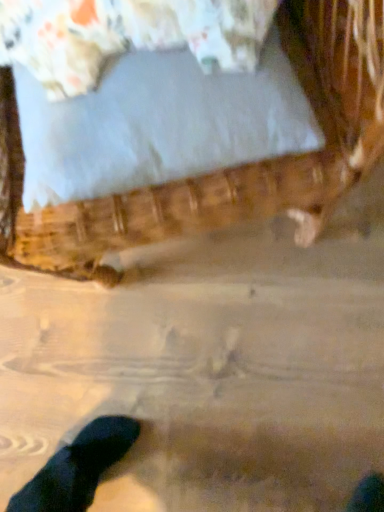
Measure the distance between white fabric pillow at upper center and camera.

white fabric pillow at upper center is 43.40 centimeters away from camera.

Find the location of a particular element. The height and width of the screenshot is (512, 384). white fabric pillow at upper center is located at coordinates (127, 35).

This screenshot has width=384, height=512. Describe the element at coordinates (127, 35) in the screenshot. I see `white fabric pillow at upper center` at that location.

Find the location of a particular element. The image size is (384, 512). wooden bed at upper center is located at coordinates (223, 169).

This screenshot has width=384, height=512. Describe the element at coordinates (223, 169) in the screenshot. I see `wooden bed at upper center` at that location.

In order to face wooden bed at upper center, should I rotate leftwards or rightwards?

It's best to rotate left around 8.963 degrees.

Find the location of a particular element. white fabric pillow at upper center is located at coordinates (127, 35).

Does white fabric pillow at upper center appear on the left side of wooden bed at upper center?

No, white fabric pillow at upper center is not to the left of wooden bed at upper center.

Which is behind, white fabric pillow at upper center or wooden bed at upper center?

Positioned behind is white fabric pillow at upper center.

Is point (187, 31) positioned in front of point (14, 234)?

Yes, it is.

From the image's perspective, which one is positioned lower, white fabric pillow at upper center or wooden bed at upper center?

From the image's view, white fabric pillow at upper center is below.

From a real-world perspective, is white fabric pillow at upper center physically above wooden bed at upper center?

Indeed, from a real-world perspective, white fabric pillow at upper center stands above wooden bed at upper center.

Between white fabric pillow at upper center and wooden bed at upper center, which one has smaller width?

Thinner between the two is white fabric pillow at upper center.

Is white fabric pillow at upper center taller or shorter than wooden bed at upper center?

In the image, white fabric pillow at upper center appears to be shorter than wooden bed at upper center.

Does white fabric pillow at upper center have a larger size compared to wooden bed at upper center?

Actually, white fabric pillow at upper center might be smaller than wooden bed at upper center.

Is white fabric pillow at upper center not inside wooden bed at upper center?

Actually, white fabric pillow at upper center is at least partially inside wooden bed at upper center.

Looking at this image, is white fabric pillow at upper center positioned far away from wooden bed at upper center?

white fabric pillow at upper center is near wooden bed at upper center, not far away.

Is white fabric pillow at upper center facing towards wooden bed at upper center?

Yes, white fabric pillow at upper center is facing wooden bed at upper center.

This screenshot has width=384, height=512. Find the location of `pillow above the wooden bed at upper center (from a real-world perspective)`. pillow above the wooden bed at upper center (from a real-world perspective) is located at coordinates (127, 35).

Considering the relative positions of wooden bed at upper center and white fabric pillow at upper center in the image provided, is wooden bed at upper center to the left of white fabric pillow at upper center from the viewer's perspective?

Yes, wooden bed at upper center is to the left of white fabric pillow at upper center.

Does wooden bed at upper center lie in front of white fabric pillow at upper center?

Yes.

Is point (207, 199) more distant than point (255, 24)?

Yes, point (207, 199) is behind point (255, 24).

From the image's perspective, does wooden bed at upper center appear lower than white fabric pillow at upper center?

No.

From a real-world perspective, is wooden bed at upper center physically located above or below white fabric pillow at upper center?

wooden bed at upper center is below white fabric pillow at upper center.

Can you confirm if wooden bed at upper center is thinner than white fabric pillow at upper center?

No.

In terms of height, does wooden bed at upper center look taller or shorter compared to white fabric pillow at upper center?

Considering their sizes, wooden bed at upper center has more height than white fabric pillow at upper center.

Considering the sizes of wooden bed at upper center and white fabric pillow at upper center in the image, is wooden bed at upper center bigger or smaller than white fabric pillow at upper center?

Considering their sizes, wooden bed at upper center takes up more space than white fabric pillow at upper center.

Is white fabric pillow at upper center located within wooden bed at upper center?

That's correct, white fabric pillow at upper center is inside wooden bed at upper center.

Is wooden bed at upper center next to white fabric pillow at upper center?

No, wooden bed at upper center is not next to white fabric pillow at upper center.

Is wooden bed at upper center oriented towards white fabric pillow at upper center?

Yes, wooden bed at upper center faces towards white fabric pillow at upper center.

Measure the distance between wooden bed at upper center and white fabric pillow at upper center.

A distance of 6.24 inches exists between wooden bed at upper center and white fabric pillow at upper center.

The image size is (384, 512). What are the coordinates of `pillow above the wooden bed at upper center (from a real-world perspective)` in the screenshot? It's located at (127, 35).

Locate an element on the screen. furniture that appears in front of the white fabric pillow at upper center is located at coordinates (223, 169).

This screenshot has width=384, height=512. I want to click on pillow located above the wooden bed at upper center (from a real-world perspective), so click(127, 35).